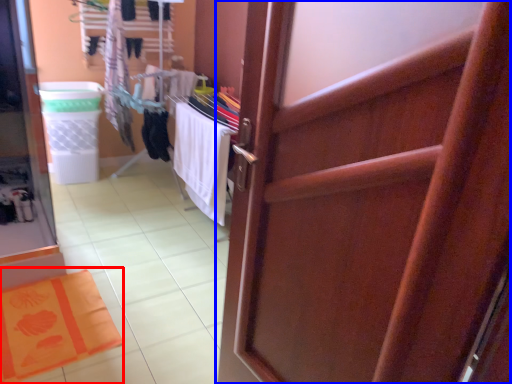
Question: Among these objects, which one is farthest to the camera, bath mat (highlighted by a red box) or door (highlighted by a blue box)?

Choices:
 (A) bath mat
 (B) door

Answer: (A)